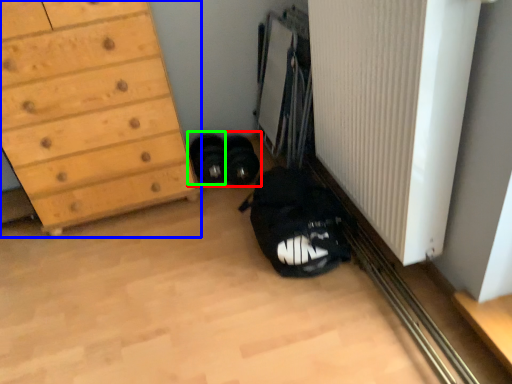
Question: Which object is the farthest from footwear (highlighted by a red box)? Choose among these: chest of drawers (highlighted by a blue box) or footwear (highlighted by a green box).

Choices:
 (A) chest of drawers
 (B) footwear

Answer: (A)